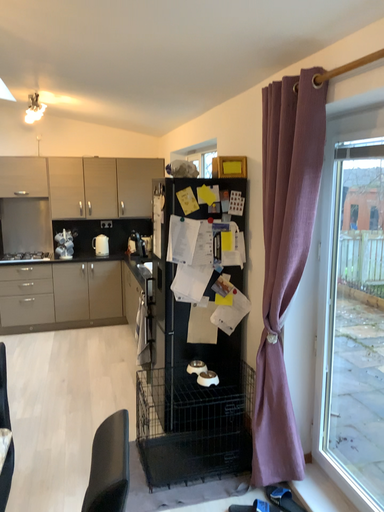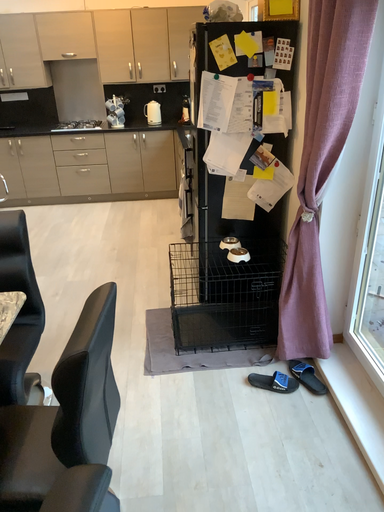
Question: Which way did the camera rotate in the video?

Choices:
 (A) rotated right
 (B) rotated left

Answer: (B)